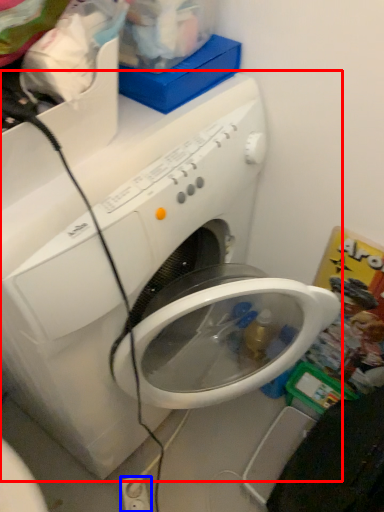
Question: Which object appears farthest to the camera in this image, washing machine (highlighted by a red box) or electric outlet (highlighted by a blue box)?

Choices:
 (A) washing machine
 (B) electric outlet

Answer: (B)